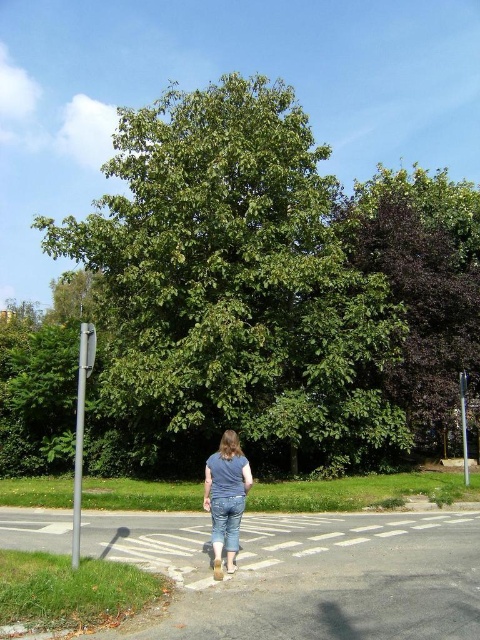
Question: Can you confirm if white asphalt at center is thinner than blue denim jeans at center?

Choices:
 (A) no
 (B) yes

Answer: (B)

Question: Which point is farther to the camera?

Choices:
 (A) blue denim jeans at center
 (B) green leafy tree at center
 (C) dark purple leafy tree at upper right
 (D) white asphalt at center

Answer: (C)

Question: Among these objects, which one is nearest to the camera?

Choices:
 (A) blue denim jeans at center
 (B) white asphalt at center

Answer: (A)

Question: Is dark purple leafy tree at upper right below white asphalt at center?

Choices:
 (A) yes
 (B) no

Answer: (B)

Question: Which object appears farthest from the camera in this image?

Choices:
 (A) blue denim jeans at center
 (B) green leafy tree at center
 (C) dark purple leafy tree at upper right

Answer: (C)

Question: Is the position of green leafy tree at center more distant than that of dark purple leafy tree at upper right?

Choices:
 (A) yes
 (B) no

Answer: (B)